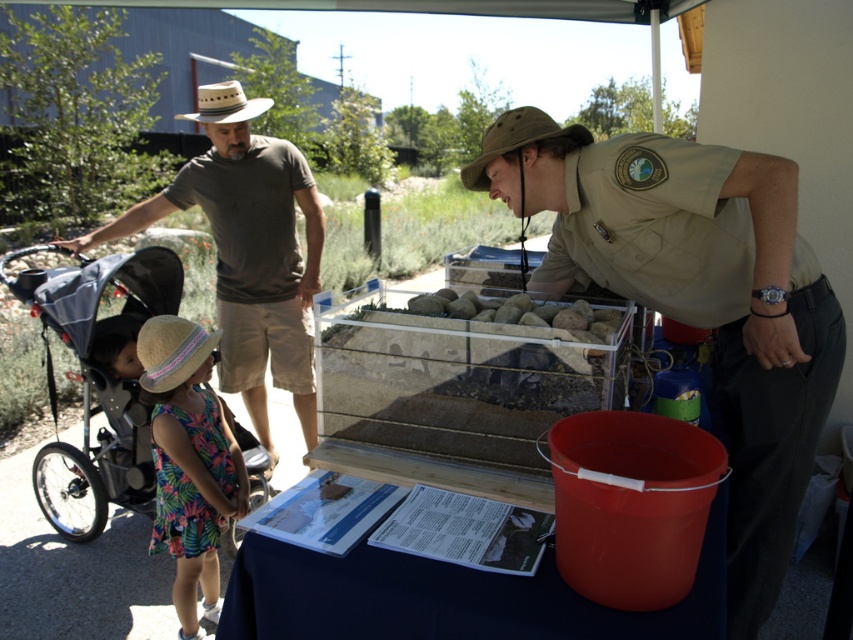
Can you confirm if khaki uniform at center is thinner than floral dress at lower left?

No.

Does khaki uniform at center appear on the right side of floral dress at lower left?

Yes, khaki uniform at center is to the right of floral dress at lower left.

What do you see at coordinates (695, 298) in the screenshot? The height and width of the screenshot is (640, 853). I see `khaki uniform at center` at bounding box center [695, 298].

Locate an element on the screen. The image size is (853, 640). khaki uniform at center is located at coordinates (695, 298).

Does khaki uniform at center have a smaller size compared to green canvas hat at upper center?

No, khaki uniform at center is not smaller than green canvas hat at upper center.

Is khaki uniform at center further to the viewer compared to green canvas hat at upper center?

That is False.

Describe the element at coordinates (695, 298) in the screenshot. I see `khaki uniform at center` at that location.

This screenshot has width=853, height=640. In order to click on khaki uniform at center in this screenshot , I will do `click(695, 298)`.

Which is behind, point (91, 259) or point (486, 132)?

The point (91, 259) is behind.

Is point (155, 250) closer to camera compared to point (527, 108)?

No, (155, 250) is behind (527, 108).

What do you see at coordinates (97, 380) in the screenshot? The height and width of the screenshot is (640, 853). I see `black fabric stroller at left` at bounding box center [97, 380].

You are a GUI agent. You are given a task and a screenshot of the screen. Output one action in this format:
    pyautogui.click(x=<x>, y=<y>)
    Task: Click on the black fabric stroller at left
    Image resolution: width=853 pixels, height=640 pixels.
    Given the screenshot: What is the action you would take?
    pyautogui.click(x=97, y=380)